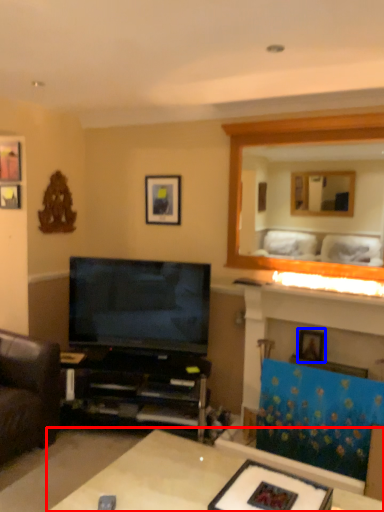
Question: Which point is further to the camera, table (highlighted by a red box) or picture frame (highlighted by a blue box)?

Choices:
 (A) table
 (B) picture frame

Answer: (B)